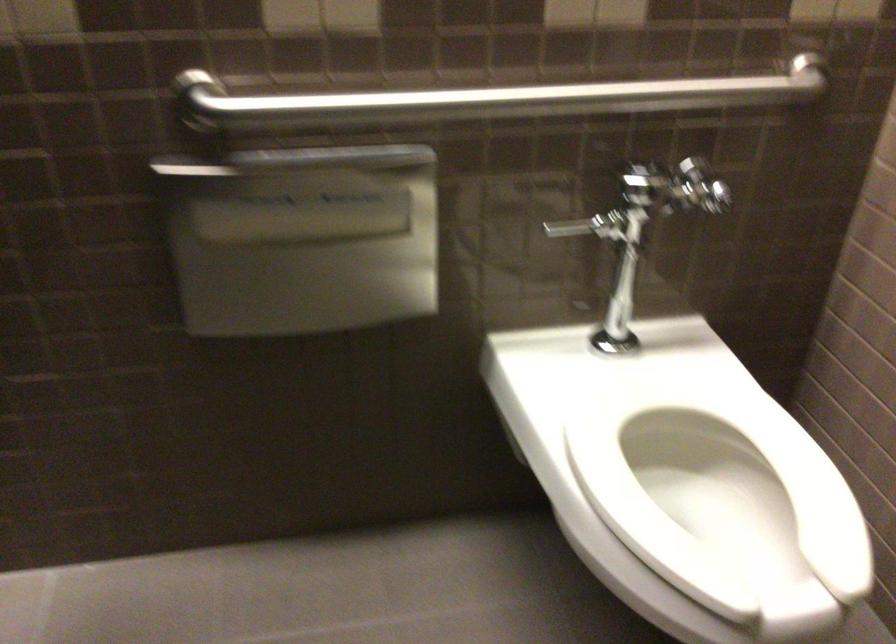
I want to click on toilet flush handle, so click(589, 225).